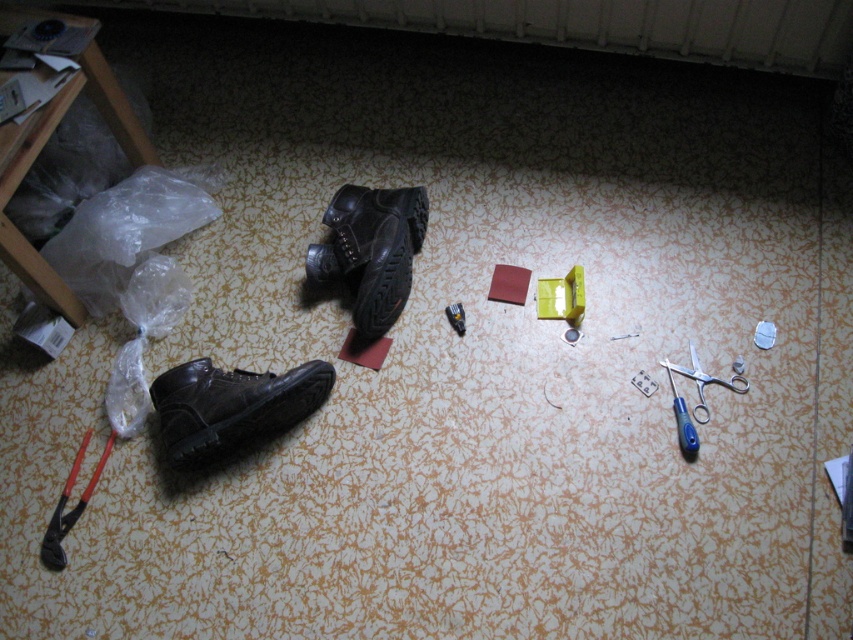
In the scene shown: You are a cleaning robot with a 2.5 feet wide cleaning path. You need to move from the black rubber pliers at lower left to the blue plastic scissors at lower right. Can you navigate directly between them without moving sideways?

The distance between the black rubber pliers at lower left and the blue plastic scissors at lower right is 3.72 feet. Since your cleaning path is 2.5 feet wide, you can move directly between them as the distance is greater than your path width.

You are trying to find the leather shoe at center on a cluttered floor. Based on the coordinates provided, can you determine its exact position relative to the other items?

The leather shoe at center is located at point (370, 250), which places it in the central area of the image as described. However, without specific coordinate references for other items, precise spatial relationships cannot be determined beyond its central placement.